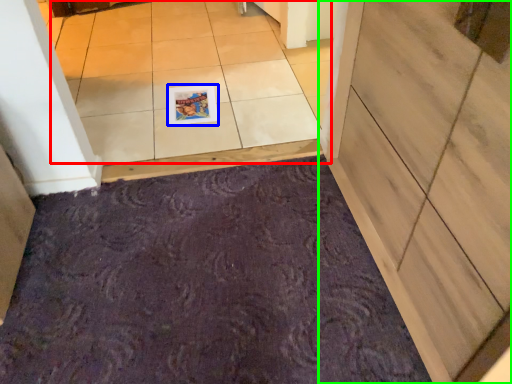
Question: Considering the real-world distances, which object is closest to tile (highlighted by a red box)? postcard (highlighted by a blue box) or door (highlighted by a green box).

Choices:
 (A) postcard
 (B) door

Answer: (A)